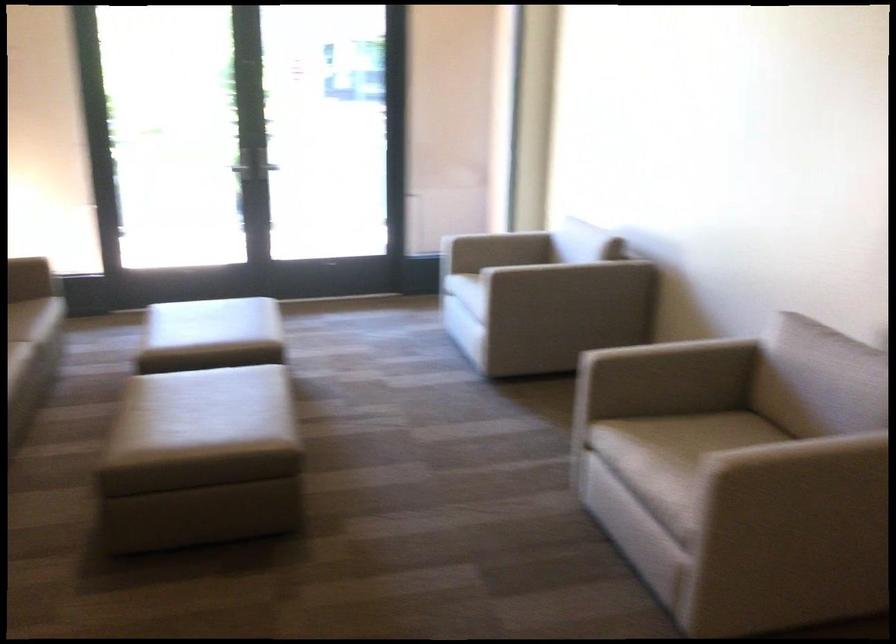
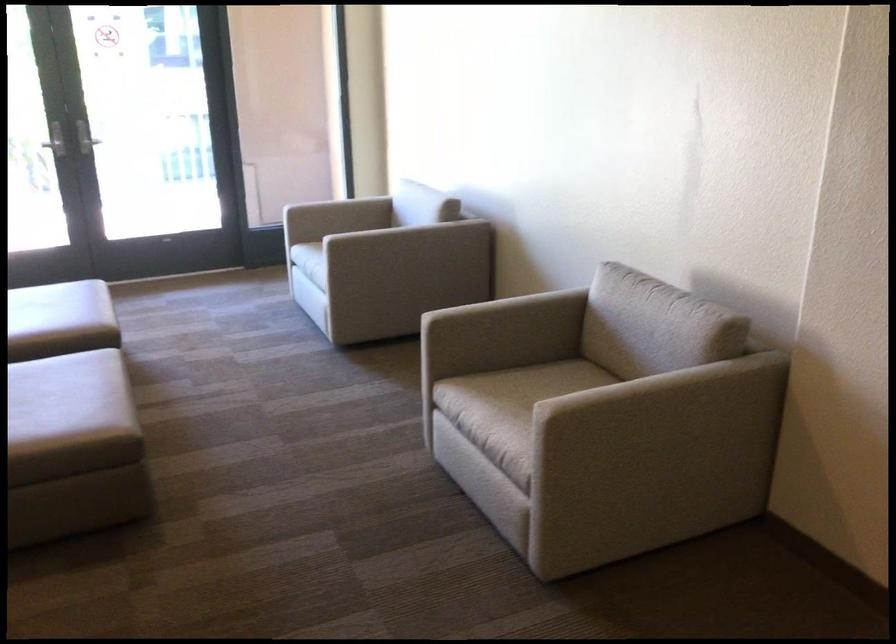
In the second image, find the point that corresponds to pixel 679 351 in the first image.

(513, 304)